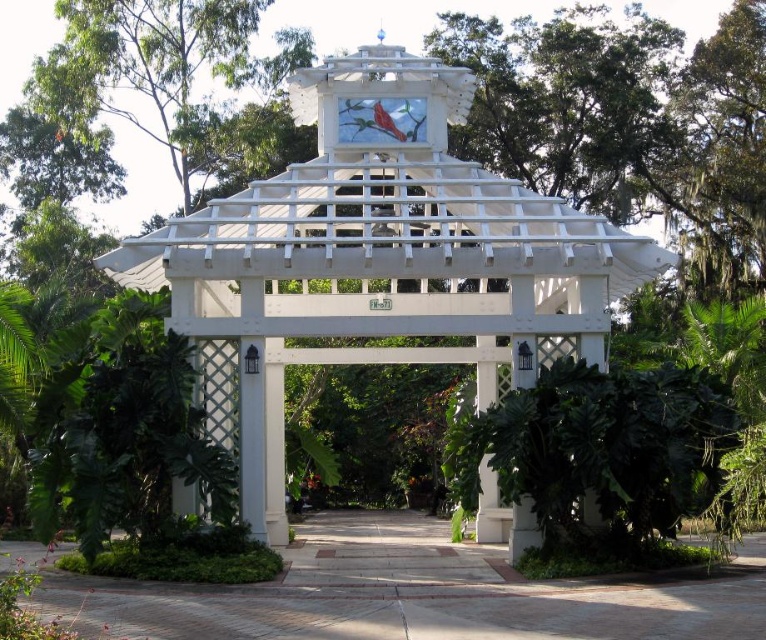
Based on the photo, you are planning to host a small gathering in the garden. You want to place a round table in the center of the white lattice gazebo at center. Since the gazebo is over the paved stone path at center, will the table be on the path or next to it?

The white lattice gazebo at center is positioned over the paved stone path at center, so placing the round table in the center of the white lattice gazebo at center would mean the table is on the paved stone path at center.

You are standing in the tropical garden and see the white lattice gazebo at center. There is a point marked at coordinates (381, 256). Where is this point located?

The point at (381, 256) is on the white lattice gazebo at center.

You are standing at the entrance of the tropical garden and see two points marked in the image. The first point is at coordinate point [359,189] and the second is at point [224,600]. If you want to walk towards the point that is closer to you, which coordinate should you head towards?

Point [224,600] is closer to you since point [359,189] is behind it.